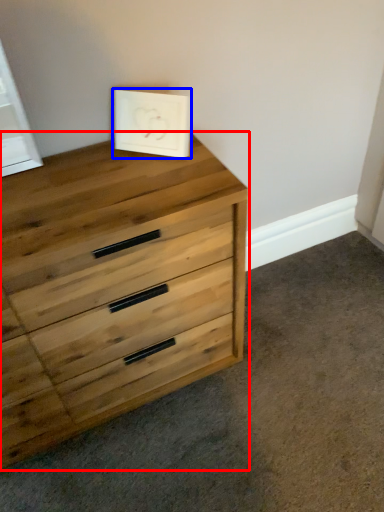
Question: Which of the following is the farthest to the observer, chest of drawers (highlighted by a red box) or picture frame (highlighted by a blue box)?

Choices:
 (A) chest of drawers
 (B) picture frame

Answer: (B)